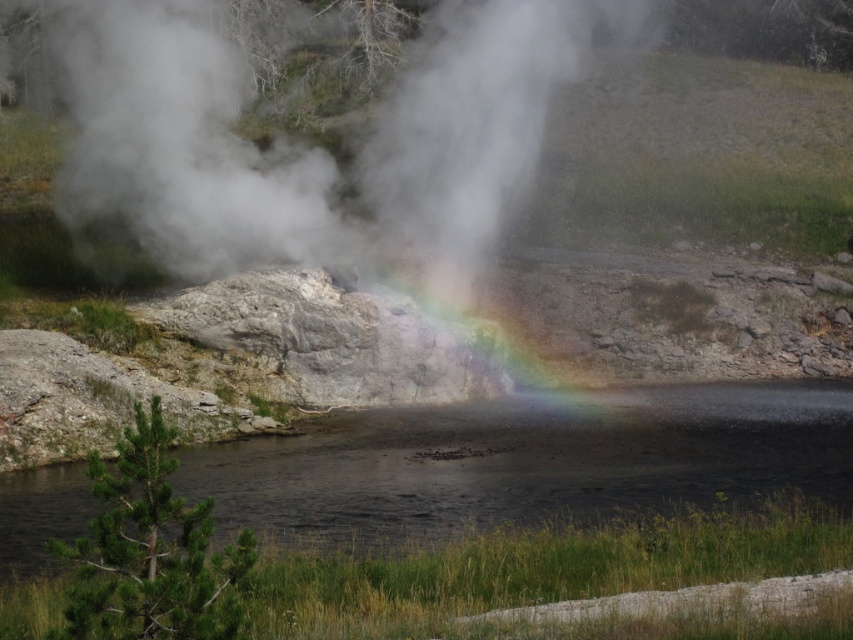
Question: Is white vapor at center to the left of transparent water at center from the viewer's perspective?

Choices:
 (A) yes
 (B) no

Answer: (A)

Question: Which point appears closest to the camera in this image?

Choices:
 (A) (234, 198)
 (B) (361, 413)

Answer: (B)

Question: Which of the following is the farthest from the observer?

Choices:
 (A) transparent water at center
 (B) white vapor at center

Answer: (B)

Question: Considering the relative positions of white vapor at center and transparent water at center in the image provided, where is white vapor at center located with respect to transparent water at center?

Choices:
 (A) right
 (B) left

Answer: (B)

Question: In this image, where is white vapor at center located relative to transparent water at center?

Choices:
 (A) below
 (B) above

Answer: (B)